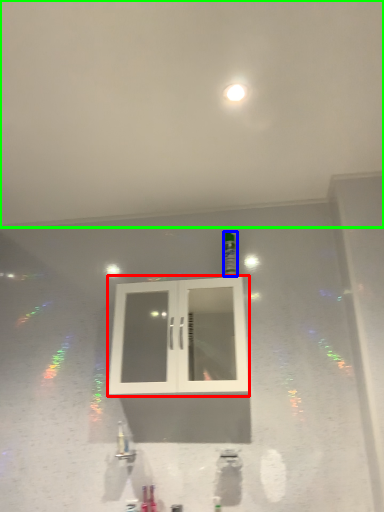
Question: Which is farther away from window (highlighted by a red box)? bottle (highlighted by a blue box) or backdrop (highlighted by a green box)?

Choices:
 (A) bottle
 (B) backdrop

Answer: (B)